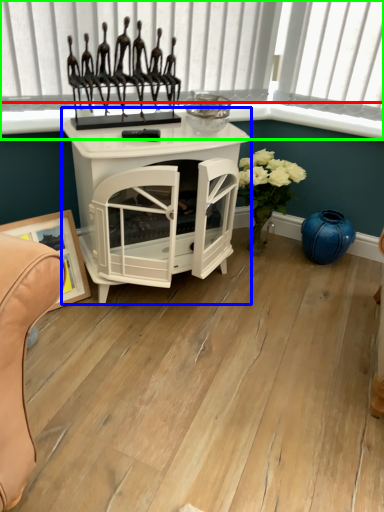
Question: Which is nearer to the window sill (highlighted by a red box)? table (highlighted by a blue box) or window frame (highlighted by a green box).

Choices:
 (A) table
 (B) window frame

Answer: (B)